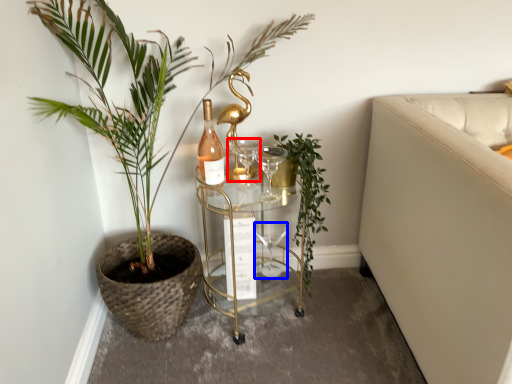
Question: Which of the following is the closest to the observer, wine glass (highlighted by a red box) or wine glass (highlighted by a blue box)?

Choices:
 (A) wine glass
 (B) wine glass

Answer: (A)